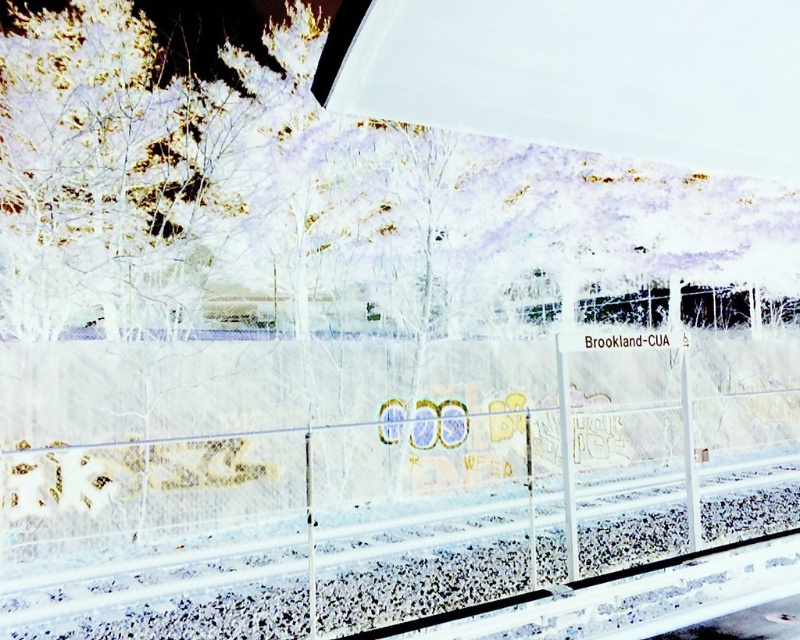
You are sitting in the vehicle and looking through the frosted window. You notice two points marked on the window. Which point is closer to your eyes? The point at coordinate (336,42) or the point at coordinate (248,577)?

The point at coordinate (336,42) is closer to your eyes because it is closer to the camera than the point at coordinate (248,577).

You are a passenger in a car and notice the white matte canopy at upper center and the smooth concrete train track at center through the frosted window. Which object appears smaller in size?

The white matte canopy at upper center appears smaller in size compared to the smooth concrete train track at center.